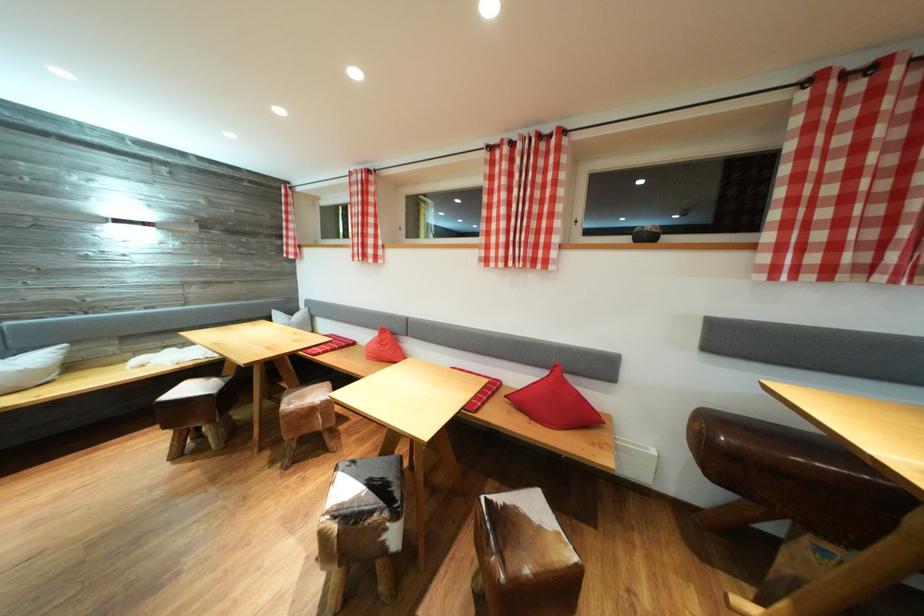
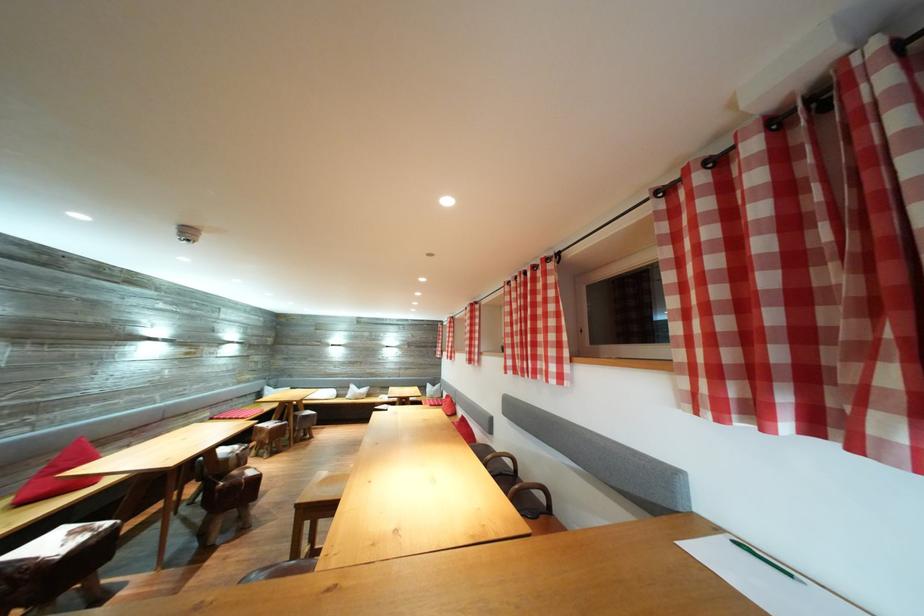
Question: I am providing you with two images of the same scene from different viewpoints. After the viewpoint changes to image2, which objects are now occluded?

Choices:
 (A) cowhide stool seat
 (B) sofa sitting surface
 (C) white pillow
 (D) plastic food container

Answer: (A)